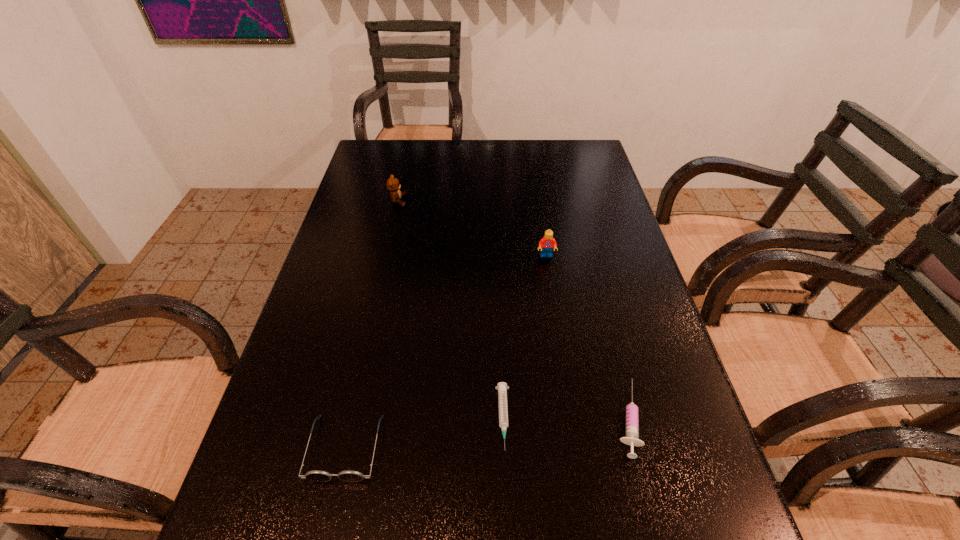
In the image, there is a desktop. At what (x,y) coordinates should I click in order to perform the action: click on vacant space at the far right corner. Please return your answer as a coordinate pair (x, y). This screenshot has height=540, width=960. Looking at the image, I should click on (555, 149).

Locate an element on the screen. The height and width of the screenshot is (540, 960). vacant space that's between the shorter syringe and the second farthest object is located at coordinates (525, 337).

Image resolution: width=960 pixels, height=540 pixels. Identify the location of unoccupied position between the fourth object from left to right and the sunglasses. (445, 352).

Where is `free spot between the Lego and the sunglasses`? The image size is (960, 540). free spot between the Lego and the sunglasses is located at coordinates (445, 352).

Where is `unoccupied area between the third object from left to right and the teddy bear`? This screenshot has width=960, height=540. unoccupied area between the third object from left to right and the teddy bear is located at coordinates (450, 309).

You are a GUI agent. You are given a task and a screenshot of the screen. Output one action in this format:
    pyautogui.click(x=<x>, y=<y>)
    Task: Click on the vacant space in between the third shortest object and the Lego
    
    Given the screenshot: What is the action you would take?
    pyautogui.click(x=445, y=352)

You are a GUI agent. You are given a task and a screenshot of the screen. Output one action in this format:
    pyautogui.click(x=<x>, y=<y>)
    Task: Click on the free space between the shortest object and the fourth object from left to right
    
    Given the screenshot: What is the action you would take?
    pyautogui.click(x=525, y=337)

At what (x,y) coordinates should I click in order to perform the action: click on unoccupied position between the left syringe and the third tallest object. Please return your answer as a coordinate pair (x, y). Looking at the image, I should click on (424, 433).

Image resolution: width=960 pixels, height=540 pixels. Identify the location of free spot between the Lego and the teddy bear. (472, 228).

At what (x,y) coordinates should I click in order to perform the action: click on vacant area that lies between the sunglasses and the right syringe. Please return your answer as a coordinate pair (x, y). The width and height of the screenshot is (960, 540). Looking at the image, I should click on (486, 433).